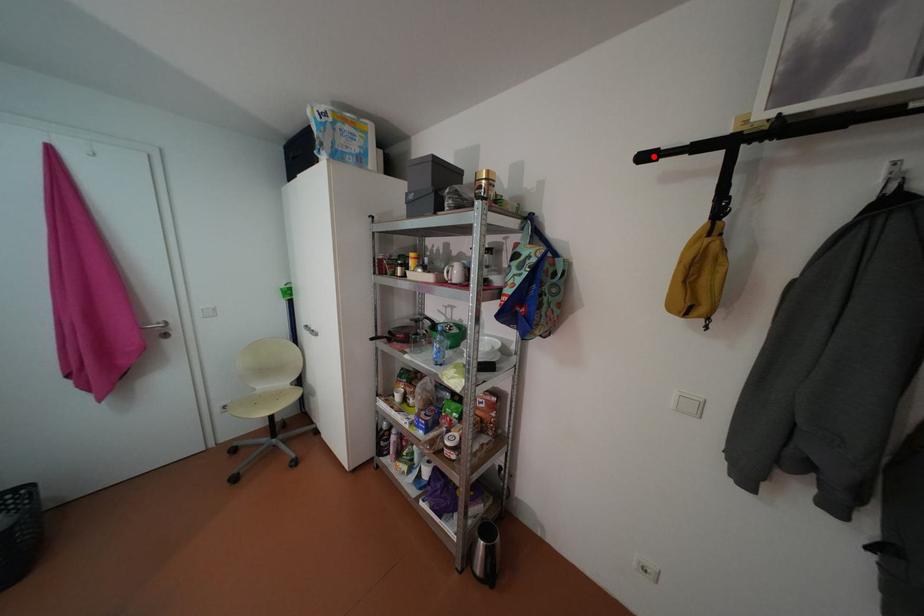
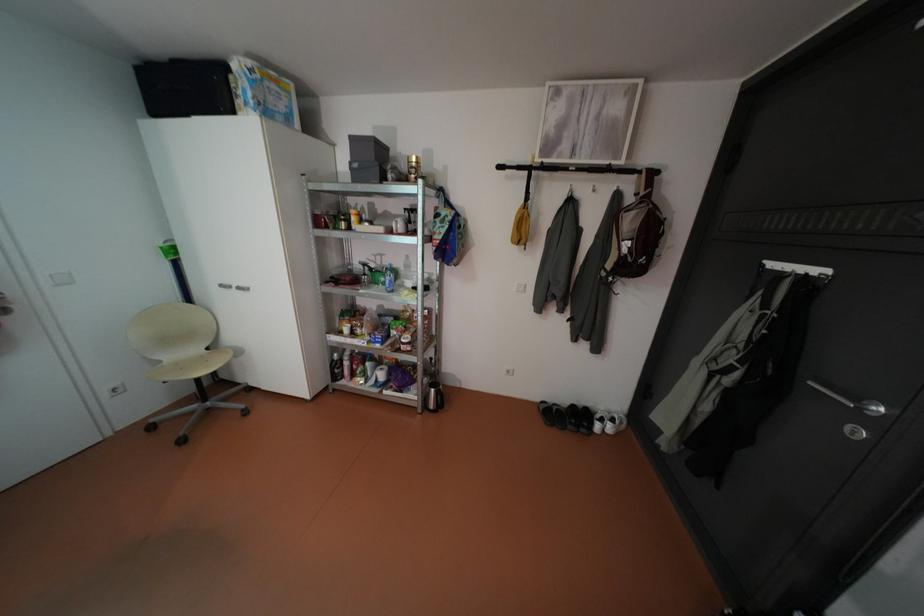
Question: I am providing you with two images of the same scene from different viewpoints. A red point is shown in image1. For the corresponding object point in image2, is it positioned nearer or farther from the camera?

Choices:
 (A) Nearer
 (B) Farther

Answer: (A)